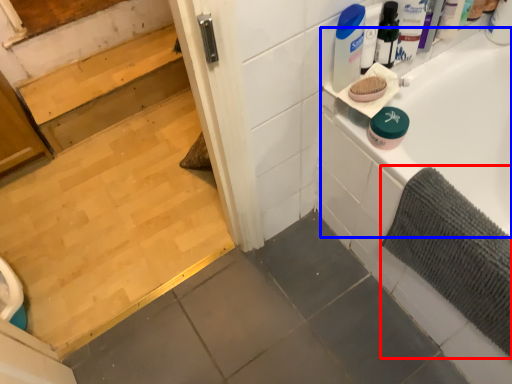
Question: Which object is closer to the camera taking this photo, bath mat (highlighted by a red box) or bathtub (highlighted by a blue box)?

Choices:
 (A) bath mat
 (B) bathtub

Answer: (A)